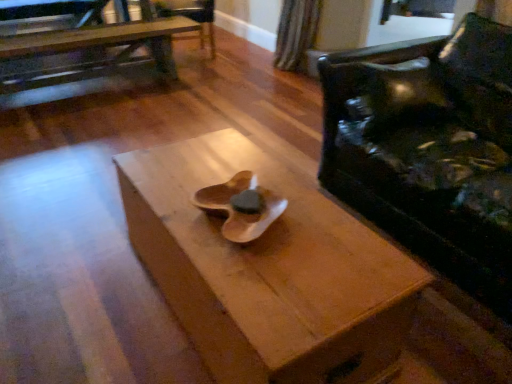
This screenshot has width=512, height=384. In order to click on blank area beneath wooden table at upper left, the second table ordered from the bottom (from a real-world perspective) in this screenshot , I will do `click(102, 87)`.